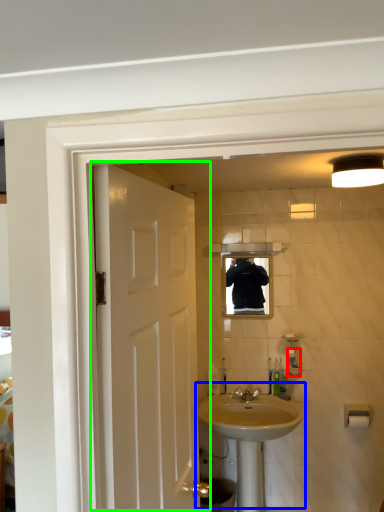
Question: Estimate the real-world distances between objects in this image. Which object is farther from toiletry (highlighted by a red box), sink (highlighted by a blue box) or door (highlighted by a green box)?

Choices:
 (A) sink
 (B) door

Answer: (B)